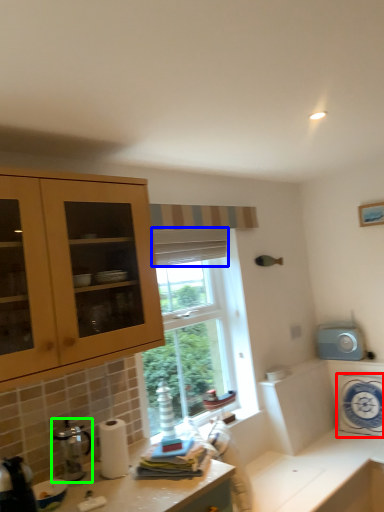
Question: Considering the real-world distances, which object is closest to appliance (highlighted by a red box)? curtain (highlighted by a blue box) or coffee machine (highlighted by a green box).

Choices:
 (A) curtain
 (B) coffee machine

Answer: (A)